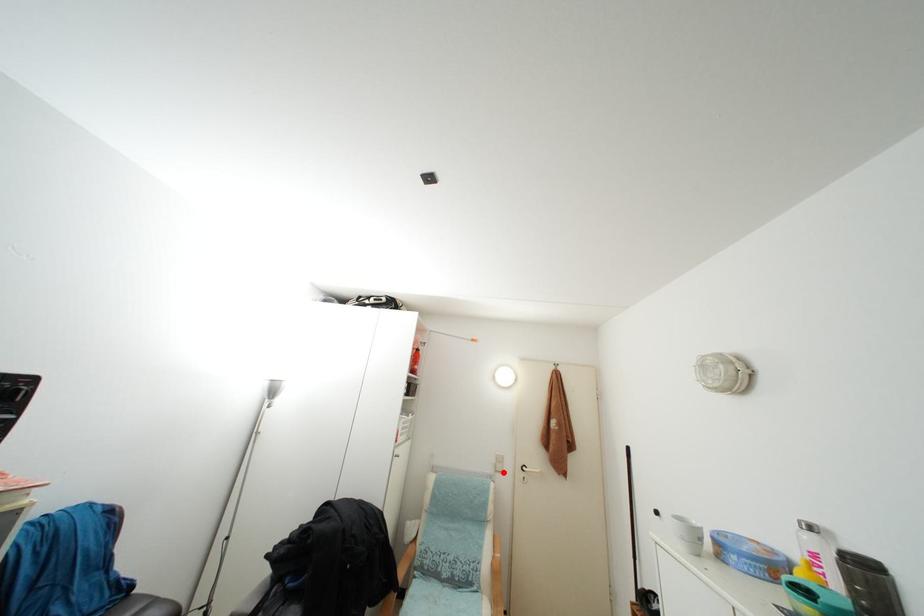
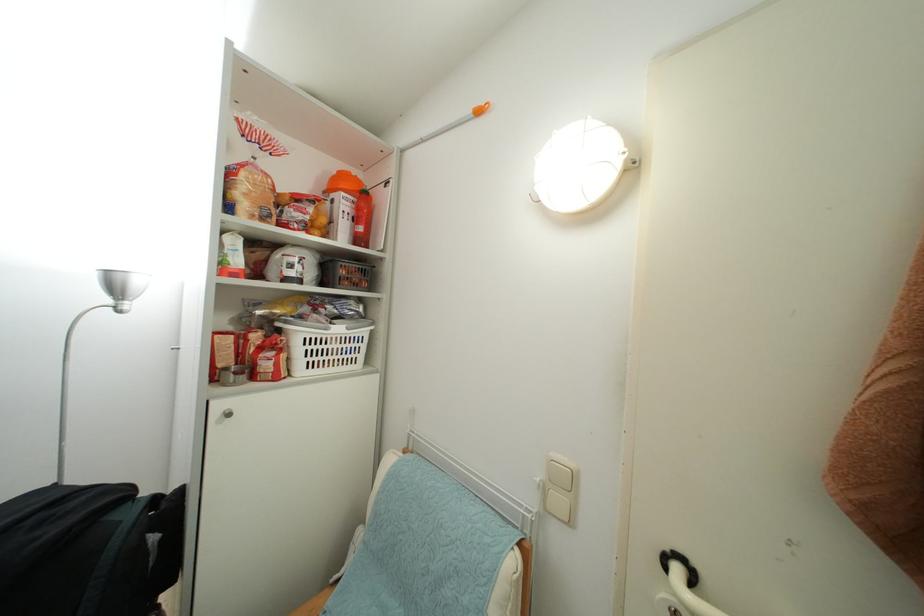
Question: I am providing you with two images of the same scene from different viewpoints. A red point is marked on the first image. Can you still see the location of the red point in image 2?

Choices:
 (A) Yes
 (B) No

Answer: (A)